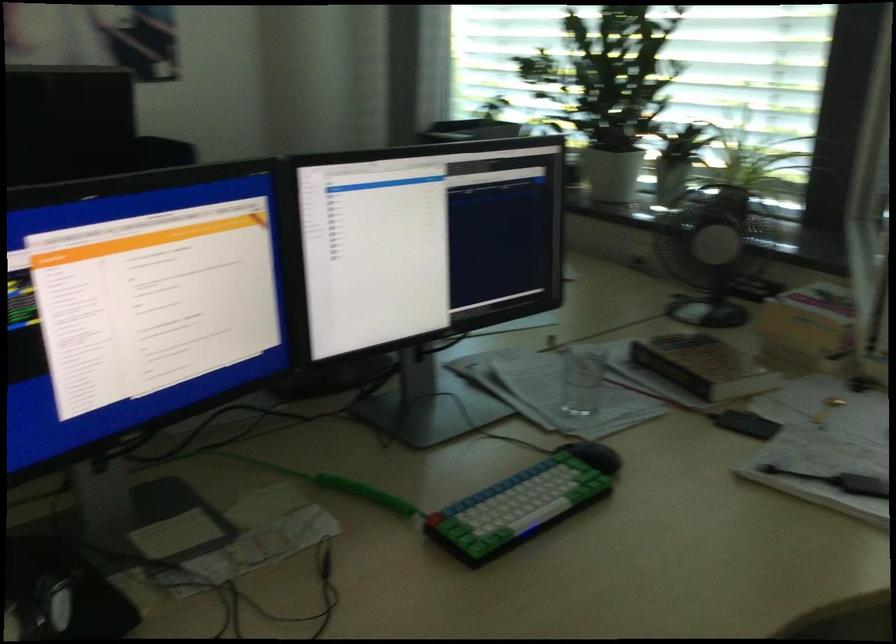
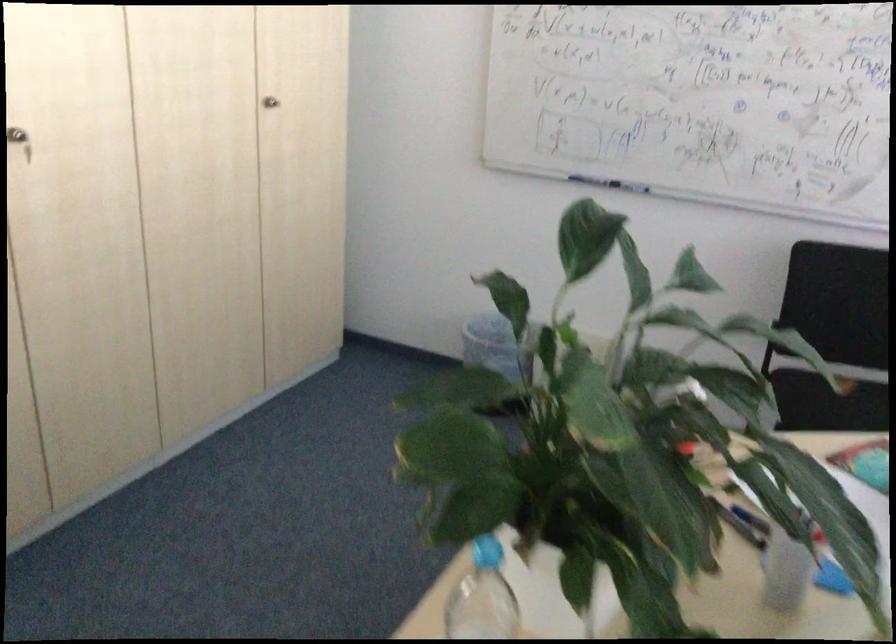
Question: The camera is either moving clockwise (left) or counter-clockwise (right) around the object. The first image is from the beginning of the video and the second image is from the end. Is the camera moving left or right when shooting the video?

Choices:
 (A) Left
 (B) Right

Answer: (B)